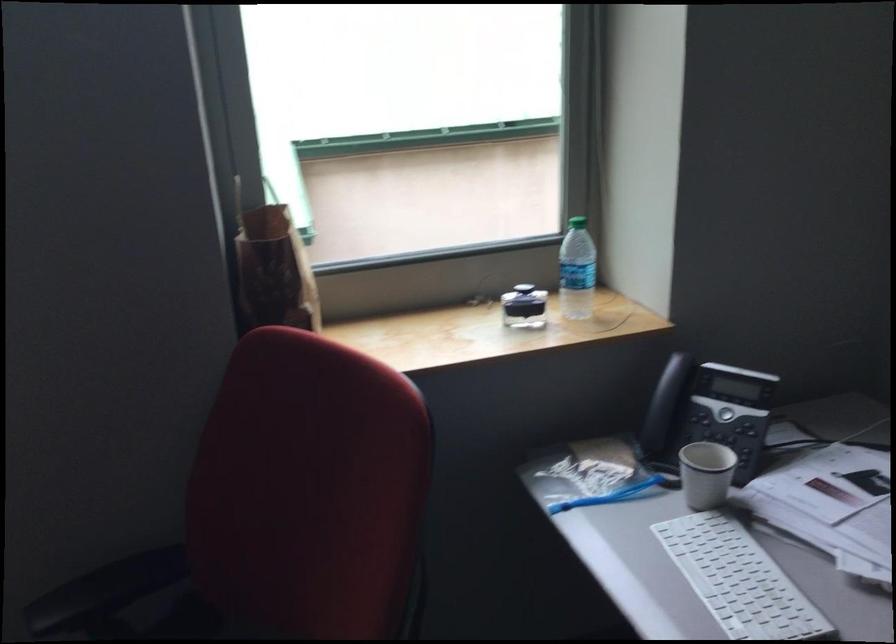
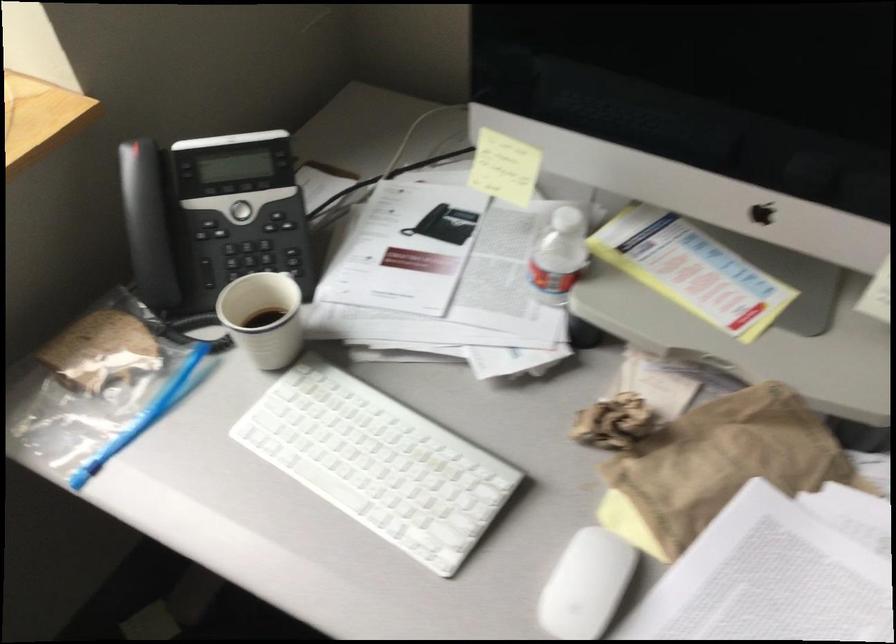
The point at (675, 383) is marked in the first image. Where is the corresponding point in the second image?

(142, 203)